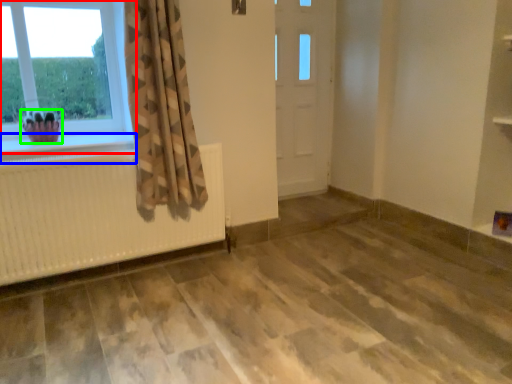
Question: Which is nearer to the window (highlighted by a red box)? window sill (highlighted by a blue box) or plant (highlighted by a green box).

Choices:
 (A) window sill
 (B) plant

Answer: (B)